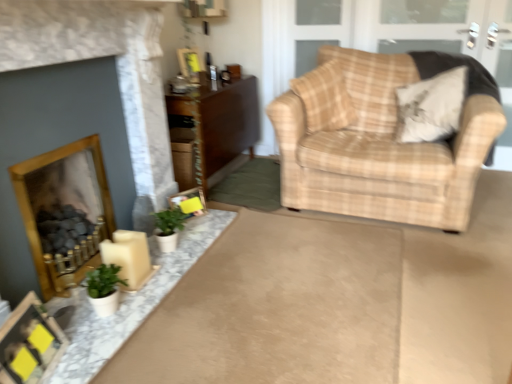
Locate an element on the screen. This screenshot has width=512, height=384. free spot to the right of green matte plant at lower left, which is counted as the 1th houseplant, starting from the back is located at coordinates (198, 237).